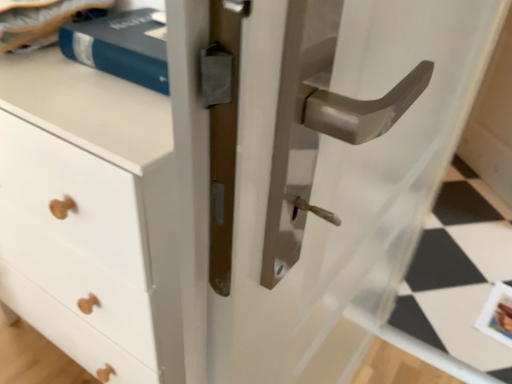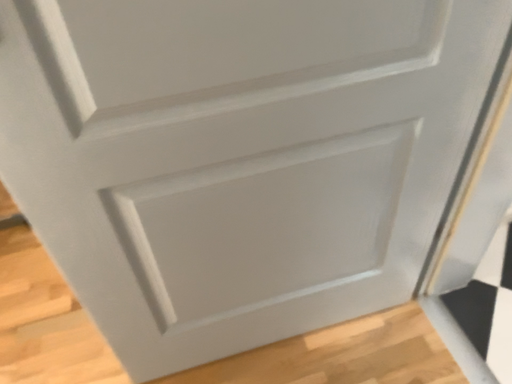
Question: How did the camera likely rotate when shooting the video?

Choices:
 (A) rotated left
 (B) rotated right

Answer: (A)